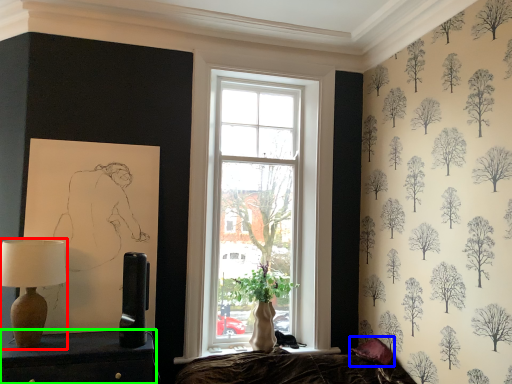
Question: Which object is positioned closest to table lamp (highlighted by a red box)? Select from pillow (highlighted by a blue box) and furniture (highlighted by a green box).

Choices:
 (A) pillow
 (B) furniture

Answer: (B)